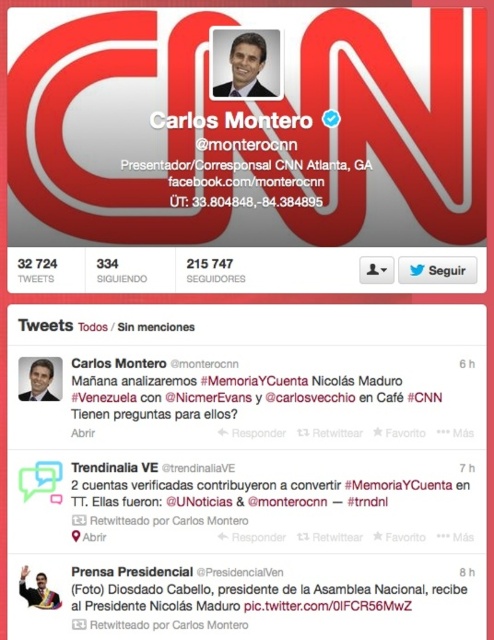
You are designing a poster for Carlos Montero and need to ensure the white glossy logo at upper center and the matte black suit at upper center are both visible. Given that the poster will be viewed from a distance, which object should be placed larger to maintain clarity?

The white glossy logo at upper center should be placed larger because it is bigger than the matte black suit at upper center, ensuring it remains clear from a distance.

You are designing a poster for Carlos Montero and need to place both the white glossy logo at upper center and the matte black suit at upper center. According to the Twitter profile image, which object should be placed lower to maintain the original layout?

The white glossy logo at upper center should be placed lower than the matte black suit at upper center because the description states it is positioned under the matte black suit at upper center.

Based on the Twitter profile image of Carlos Montero, can you determine which of the two points, point (57, 88) or point (234, 51), is closer to the viewer?

Point (57, 88) is in front of point (234, 51), so it is closer to the viewer.